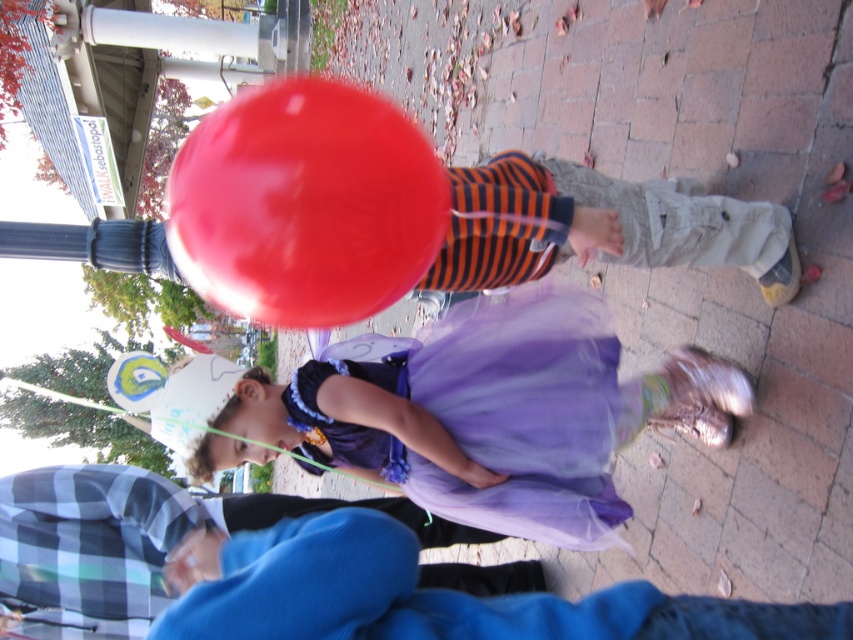
Who is more distant from viewer, (688, 387) or (299, 304)?

Point (688, 387)

Which is more to the right, purple tulle dress at center or glossy red balloon at center?

Positioned to the right is purple tulle dress at center.

Who is more forward, (386, 358) or (332, 116)?

Point (332, 116)

Locate an element on the screen. purple tulle dress at center is located at coordinates (515, 413).

Does point (364, 365) lie in front of point (630, 225)?

That is False.

Does purple tulle dress at center appear under striped fabric pants at center?

Indeed, purple tulle dress at center is positioned under striped fabric pants at center.

Based on the photo, measure the distance between purple tulle dress at center and camera.

purple tulle dress at center is 9.50 feet away from camera.

In order to click on purple tulle dress at center in this screenshot , I will do `click(515, 413)`.

Is glossy red balloon at center closer to the viewer compared to striped fabric pants at center?

No.

Find the location of a particular element. The height and width of the screenshot is (640, 853). glossy red balloon at center is located at coordinates (305, 204).